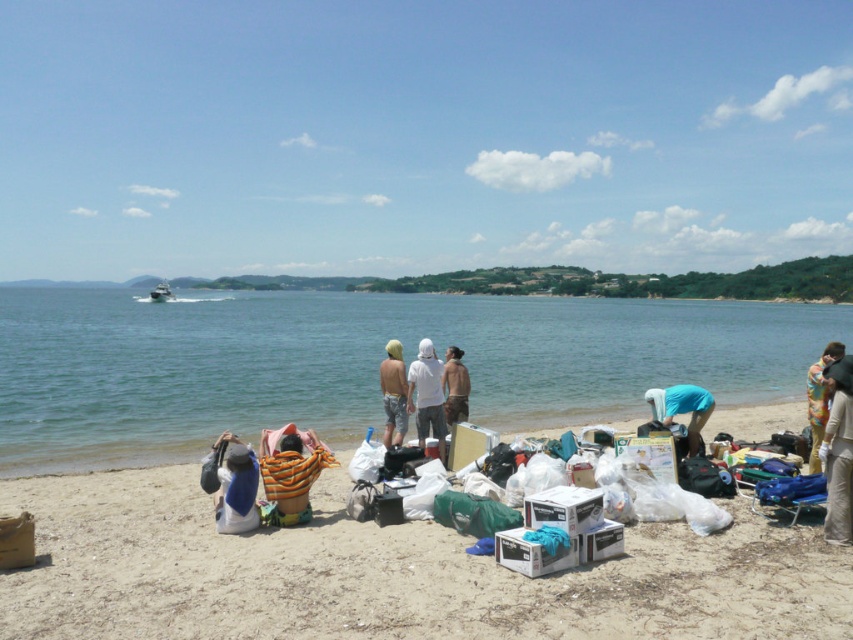
You are a person on the beach looking for your belongings. You have an orange striped towel at lower left and a white matte shirt at center. Which item is closer to you?

The orange striped towel at lower left is closer to you because it is in front of the white matte shirt at center.

You are a photographer standing at the lower left corner of the beach scene. You want to capture a photo that includes both the orange striped towel at lower left and the white matte shirt at center. Since you can only move forward or backward, can you adjust your position so that both objects are in the same frame without zooming?

The orange striped towel at lower left and white matte shirt at center are 10.36 feet apart. Since you can move forward or backward, adjusting your distance from the scene will allow both objects to fit within the camera frame. Moving further back would increase the field of view, making it possible to include both the orange striped towel at lower left and the white matte shirt at center in the same photo.